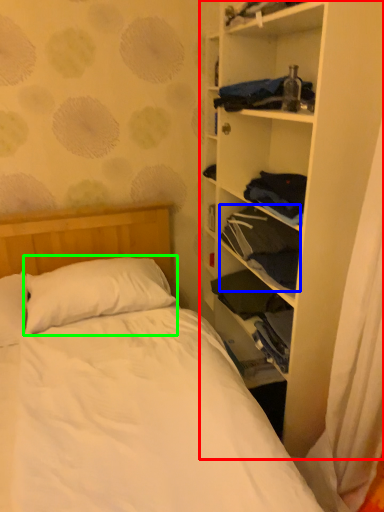
Question: Which object is positioned closest to shelf (highlighted by a red box)? Select from clothing (highlighted by a blue box) and pillow (highlighted by a green box).

Choices:
 (A) clothing
 (B) pillow

Answer: (A)